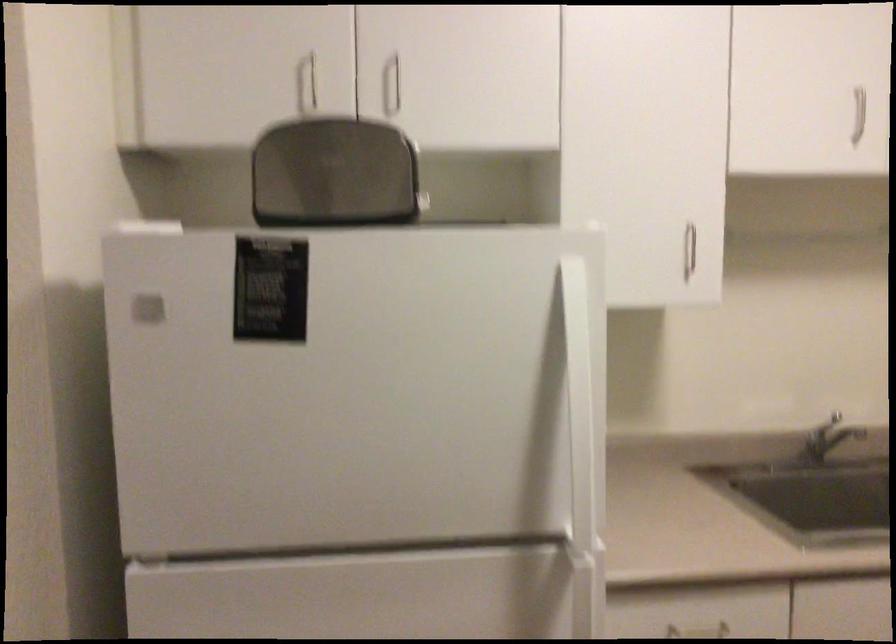
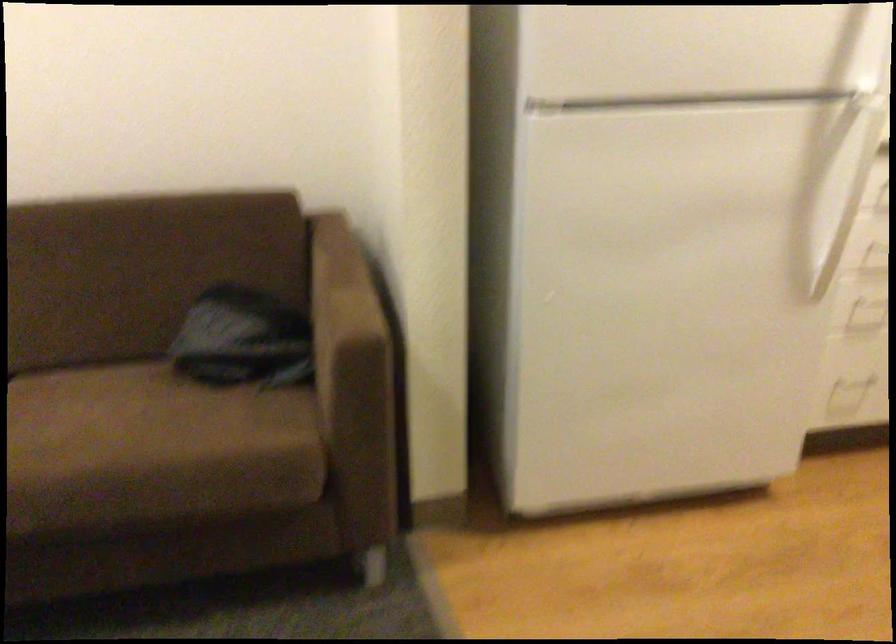
Question: The first image is from the beginning of the video and the second image is from the end. How did the camera likely rotate when shooting the video?

Choices:
 (A) Left
 (B) Right
 (C) Up
 (D) Down

Answer: (D)